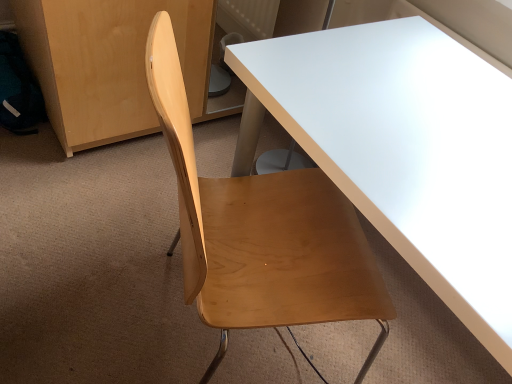
The width and height of the screenshot is (512, 384). What are the coordinates of `free space that is to the left of white glossy table at upper center` in the screenshot? It's located at (94, 257).